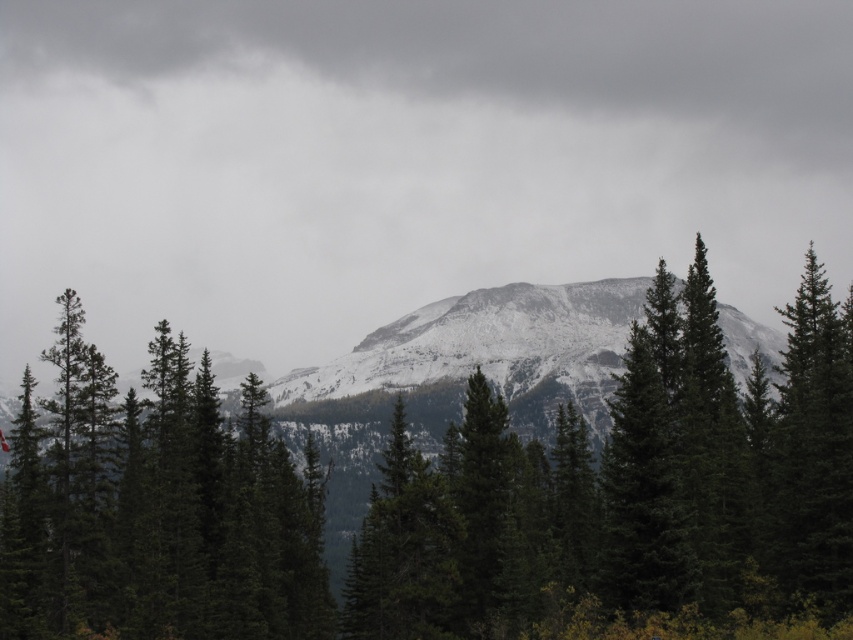
Question: From the image, what is the correct spatial relationship of green matte tree at center in relation to green matte tree at left?

Choices:
 (A) above
 (B) below

Answer: (A)

Question: Among these points, which one is farthest from the camera?

Choices:
 (A) (689, 360)
 (B) (173, 497)

Answer: (A)

Question: Does green matte tree at center have a larger size compared to green matte tree at left?

Choices:
 (A) no
 (B) yes

Answer: (B)

Question: Does green matte tree at center appear on the left side of green matte tree at left?

Choices:
 (A) yes
 (B) no

Answer: (B)